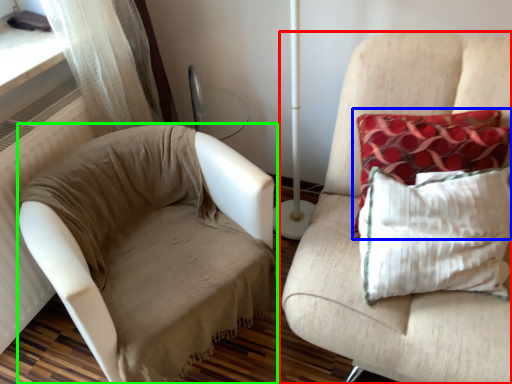
Question: Based on their relative distances, which object is nearer to furniture (highlighted by a red box)? Choose from pillow (highlighted by a blue box) and studio couch (highlighted by a green box).

Choices:
 (A) pillow
 (B) studio couch

Answer: (A)